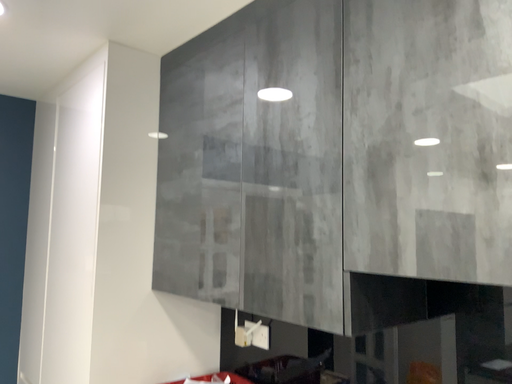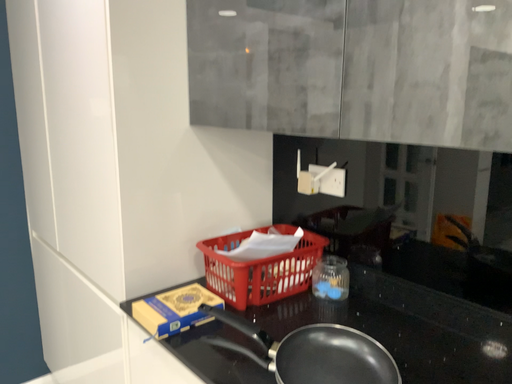
Question: How did the camera likely rotate when shooting the video?

Choices:
 (A) rotated downward
 (B) rotated upward

Answer: (A)